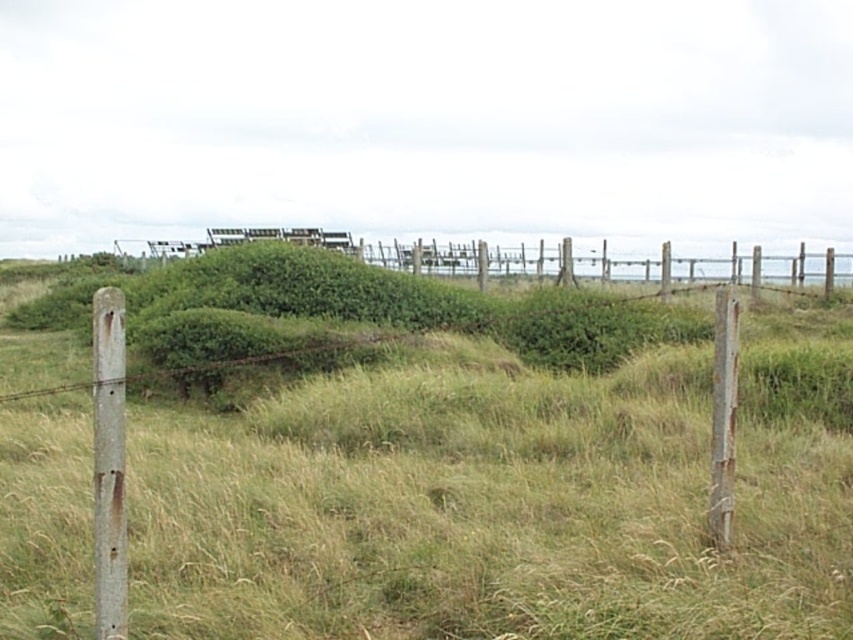
How far apart are rusty metal fence at upper center and rusty metal pole at left?

They are 28.80 meters apart.

Is point (454, 275) less distant than point (109, 461)?

No, it is not.

Find the location of a particular element. rusty metal fence at upper center is located at coordinates pos(308,246).

Can you confirm if rusty metal fence at upper center is positioned above rusty wood post at right?

Indeed, rusty metal fence at upper center is positioned over rusty wood post at right.

Is rusty metal fence at upper center bigger than rusty wood post at right?

Yes, rusty metal fence at upper center is bigger than rusty wood post at right.

What do you see at coordinates (308, 246) in the screenshot? This screenshot has height=640, width=853. I see `rusty metal fence at upper center` at bounding box center [308, 246].

Find the location of a particular element. The height and width of the screenshot is (640, 853). rusty metal fence at upper center is located at coordinates (308, 246).

What do you see at coordinates (474, 470) in the screenshot? I see `green grassy at center` at bounding box center [474, 470].

In the scene shown: Is green grassy at center to the left of rusty wood post at right from the viewer's perspective?

Indeed, green grassy at center is positioned on the left side of rusty wood post at right.

Is point (22, 568) farther from viewer compared to point (730, 444)?

No.

Locate an element on the screen. The height and width of the screenshot is (640, 853). green grassy at center is located at coordinates (474, 470).